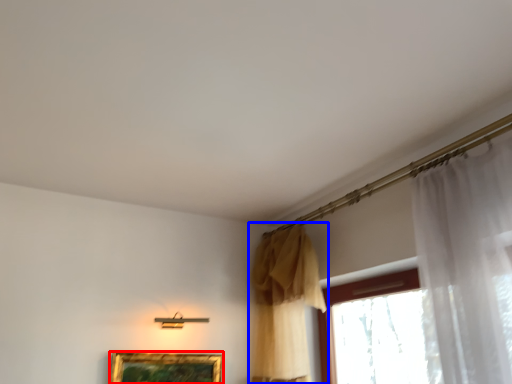
Question: Among these objects, which one is nearest to the camera, picture frame (highlighted by a red box) or curtain (highlighted by a blue box)?

Choices:
 (A) picture frame
 (B) curtain

Answer: (B)